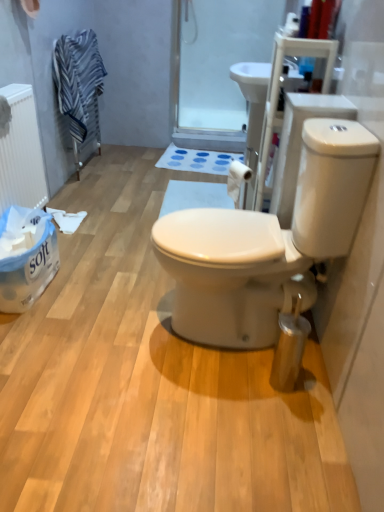
Identify the location of free space that is in between white glossy toilet at center and white paper towel at lower left. The width and height of the screenshot is (384, 512). (98, 302).